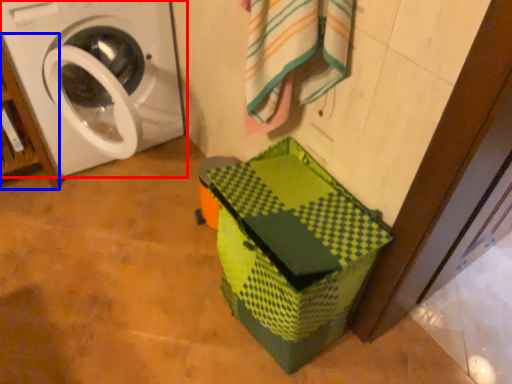
Question: Which object appears farthest to the camera in this image, washing machine (highlighted by a red box) or shelf (highlighted by a blue box)?

Choices:
 (A) washing machine
 (B) shelf

Answer: (B)